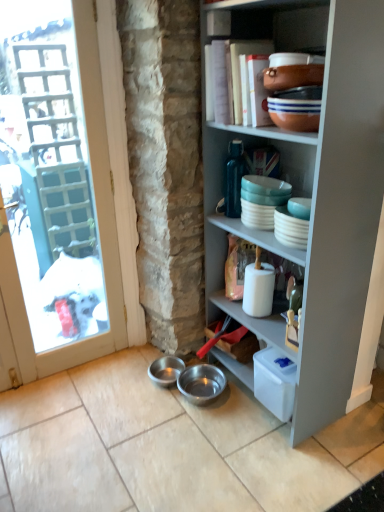
What do you see at coordinates (274, 23) in the screenshot? I see `matte ceramic bowls at upper center` at bounding box center [274, 23].

Find the location of a particular element. The height and width of the screenshot is (512, 384). matte ceramic bowls at upper center is located at coordinates (274, 23).

Measure the distance between matte ceramic bowls at upper center and camera.

matte ceramic bowls at upper center is 3.79 feet away from camera.

Where is `matte ceramic bowls at upper center`? matte ceramic bowls at upper center is located at coordinates (274, 23).